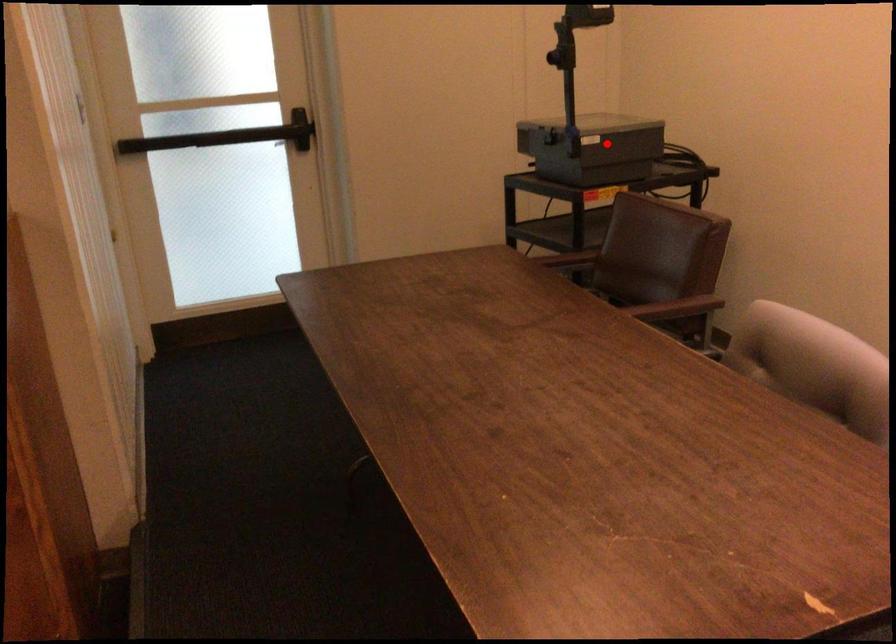
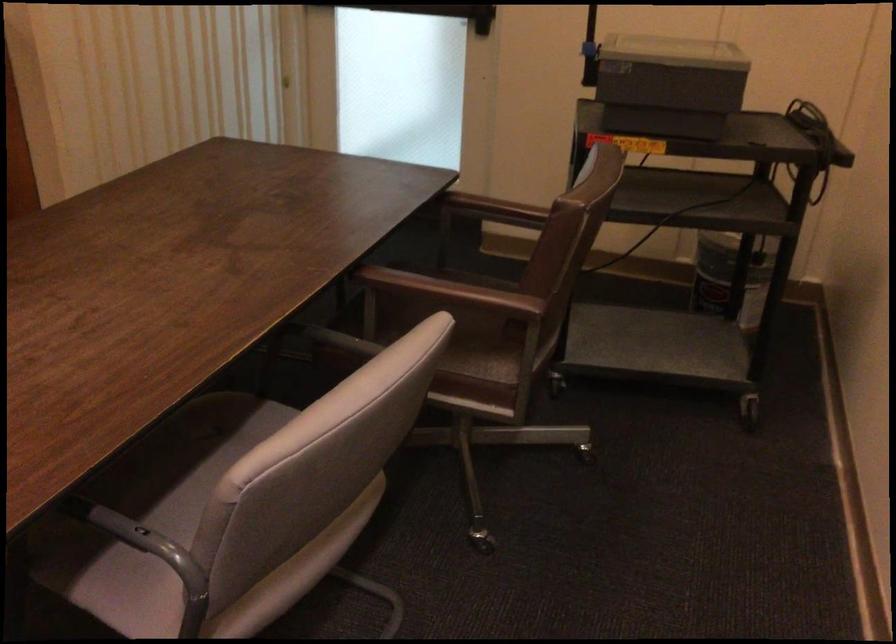
Question: I am providing you with two images of the same scene from different viewpoints. In image1, a red point is highlighted. Considering the same 3D point in image2, which of the following is correct?

Choices:
 (A) It is closer
 (B) It is farther

Answer: (A)